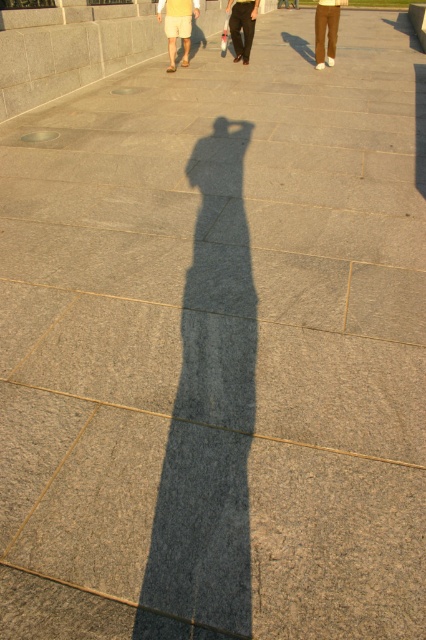
Question: Can you confirm if light yellow shorts at upper left is positioned below brown cotton pants at upper right?

Choices:
 (A) no
 (B) yes

Answer: (B)

Question: Considering the relative positions of light yellow shorts at upper left and brown cotton pants at upper right in the image provided, where is light yellow shorts at upper left located with respect to brown cotton pants at upper right?

Choices:
 (A) right
 (B) left

Answer: (B)

Question: Which object appears farthest from the camera in this image?

Choices:
 (A) brown cotton pants at upper right
 (B) black smooth pants at center
 (C) light yellow shorts at upper left

Answer: (A)

Question: Can you confirm if light yellow shorts at upper left is smaller than brown cotton pants at upper right?

Choices:
 (A) yes
 (B) no

Answer: (B)

Question: Among these objects, which one is farthest from the camera?

Choices:
 (A) black smooth pants at center
 (B) light yellow shorts at upper left

Answer: (A)

Question: Among these objects, which one is nearest to the camera?

Choices:
 (A) black smooth pants at center
 (B) light yellow shorts at upper left
 (C) brown cotton pants at upper right

Answer: (B)